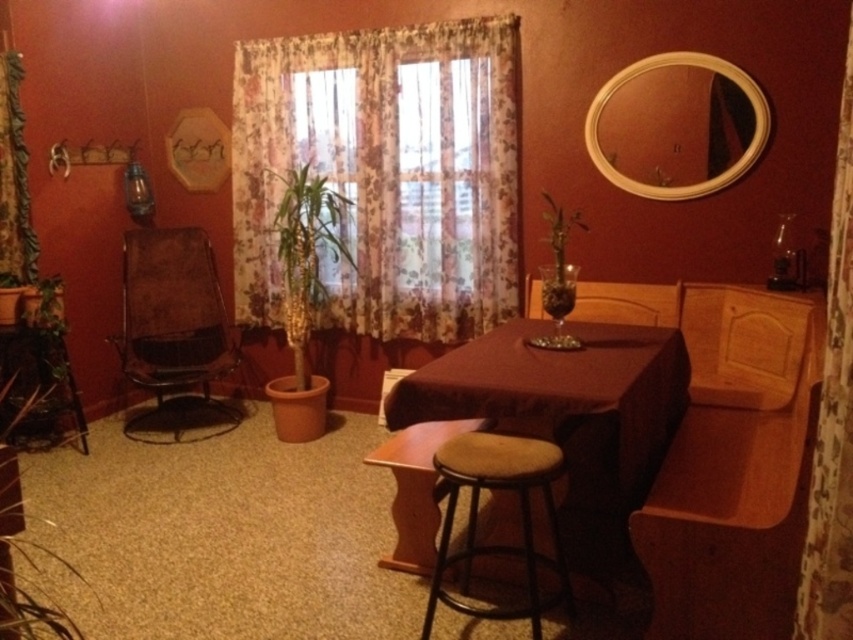
You are sitting on the brown fabric chair at left and want to look out the window. Can you see the floral fabric curtain at left blocking your view?

The floral fabric curtain at left is behind the brown fabric chair at left, so it is not blocking your view. You can see out the window without obstruction.

You are sitting in the brown fabric chair at left and want to know if the floral fabric curtain at left is above you. Can you confirm?

Yes, the brown fabric chair at left is positioned under the floral fabric curtain at left, so the curtain is indeed above the chair.